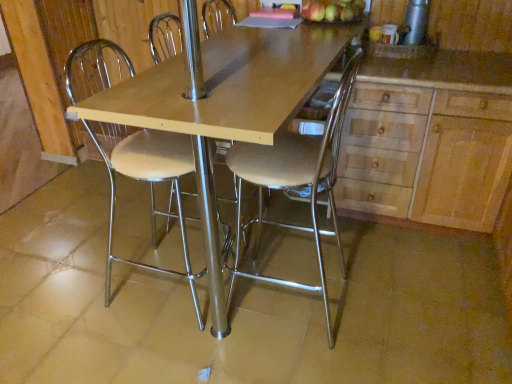
Find the location of a particular element. free space in front of metallic silver chair at center, which is the 1th chair from right to left is located at coordinates (297, 359).